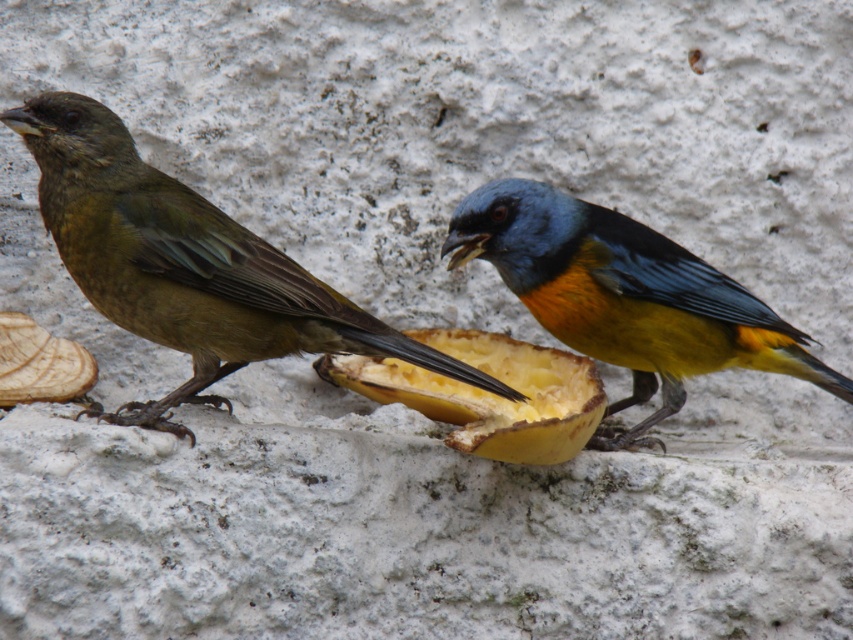
You are a birdwatcher observing two points marked on a wall where birds are perched. The points are labeled as point (294,289) and point (639,333). Based on their positions, which point is closer to you?

Point (294,289) is in front of point (639,333), so it is closer to you.

You are a birdwatcher observing two birds on a textured white surface. You notice a point labeled as point (186, 266). Which bird is this point located on?

The point (186, 266) is located on the brown matte bird at left.